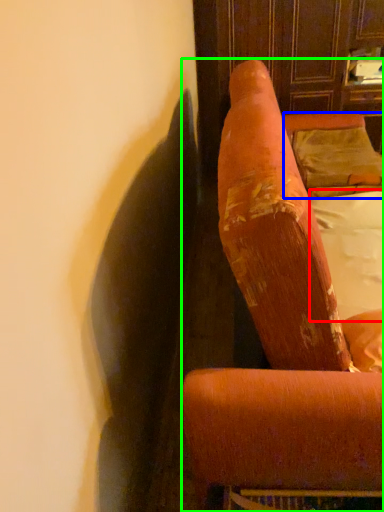
Question: Which is nearer to the sheet (highlighted by a red box)? pillow (highlighted by a blue box) or furniture (highlighted by a green box).

Choices:
 (A) pillow
 (B) furniture

Answer: (A)